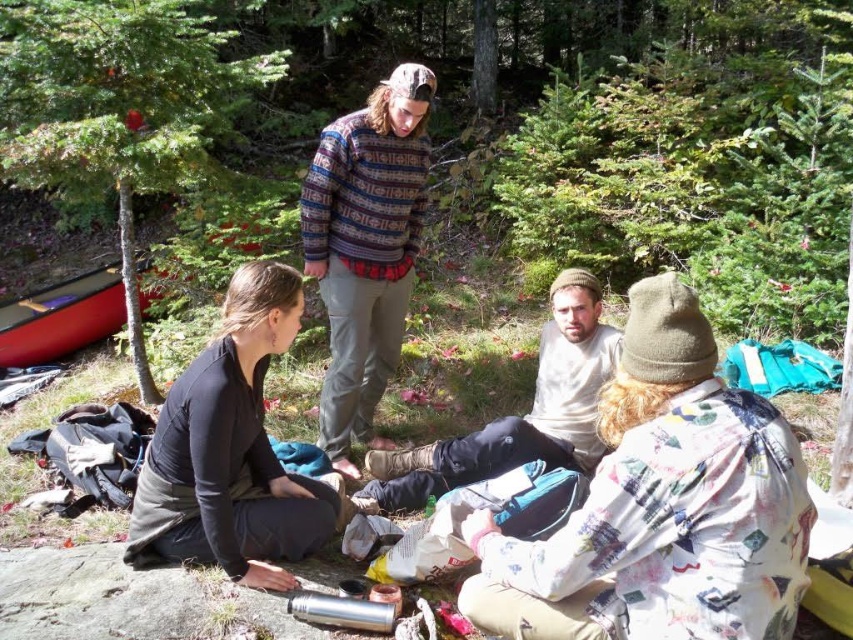
Which is above, fluffy beige hat at center or black matte shirt at lower left?

black matte shirt at lower left is above.

Who is more distant from viewer, (660, 525) or (219, 444)?

The point (219, 444) is behind.

Identify the location of fluffy beige hat at center. (660, 506).

Between knitted sweater at center and light beige cotton shirt at center, which one has less height?

Standing shorter between the two is light beige cotton shirt at center.

Is knitted sweater at center below light beige cotton shirt at center?

No, knitted sweater at center is not below light beige cotton shirt at center.

Is point (381, 348) more distant than point (581, 419)?

Yes, it is behind point (581, 419).

In order to click on knitted sweater at center in this screenshot , I will do 364,248.

Between knitted sweater at center and red plastic canoe at lower left, which one is positioned higher?

knitted sweater at center is above.

Who is more forward, (360, 188) or (80, 337)?

Positioned in front is point (360, 188).

What are the coordinates of `knitted sweater at center` in the screenshot? It's located at (364, 248).